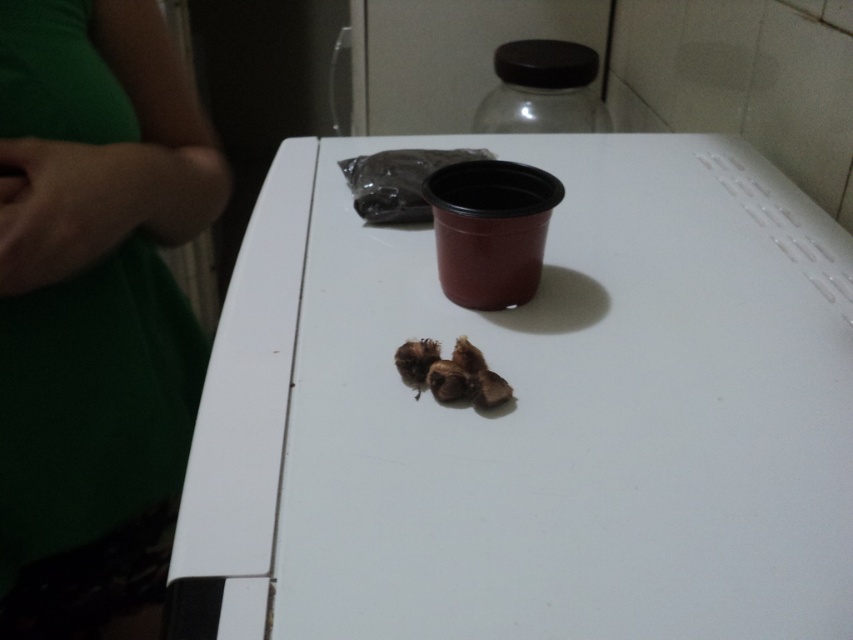
You are organizing items on a white matte table at center and need to place a green fabric at left. Considering their sizes, which object has a larger width?

The white matte table at center has a larger width than the green fabric at left according to the description.

In the scene shown: You are standing at the edge of the table and want to place a small object exactly at the center of the white matte table at center. According to the coordinates provided, where should you place it?

The center of the white matte table at center should be placed at the coordinates point (537,413) as per the provided 2D location.